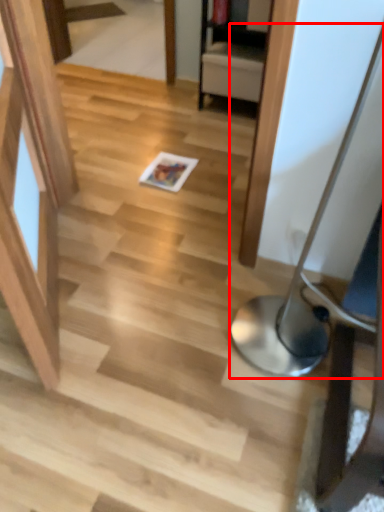
Question: From the image, what is the correct spatial relationship of table lamp (annotated by the red box) in relation to magazine?

Choices:
 (A) left
 (B) right

Answer: (B)